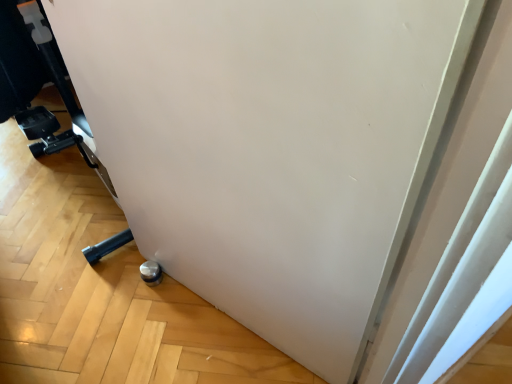
Question: Is point (144, 268) closer or farther from the camera than point (72, 109)?

Choices:
 (A) closer
 (B) farther

Answer: (A)

Question: In the image, is metallic silver wheel at lower left positioned in front of or behind metallic silver caster at lower left?

Choices:
 (A) behind
 (B) front

Answer: (A)

Question: Is metallic silver wheel at lower left wider or thinner than metallic silver caster at lower left?

Choices:
 (A) thin
 (B) wide

Answer: (A)

Question: Is metallic silver caster at lower left taller or shorter than metallic silver wheel at lower left?

Choices:
 (A) short
 (B) tall

Answer: (B)

Question: In the image, is metallic silver caster at lower left on the left side or the right side of metallic silver wheel at lower left?

Choices:
 (A) right
 (B) left

Answer: (B)

Question: Considering their positions, is metallic silver caster at lower left located in front of or behind metallic silver wheel at lower left?

Choices:
 (A) behind
 (B) front

Answer: (B)

Question: From the image's perspective, relative to metallic silver wheel at lower left, is metallic silver caster at lower left above or below?

Choices:
 (A) above
 (B) below

Answer: (A)